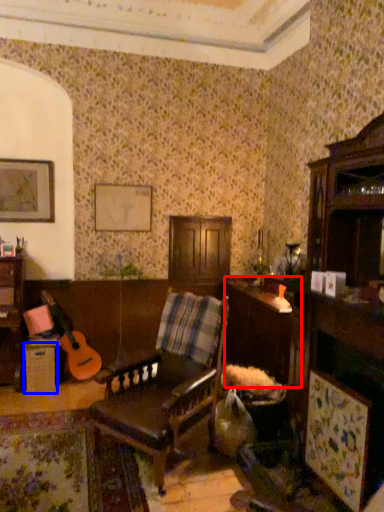
Question: Which of the following is the closest to the observer, table (highlighted by a red box) or table (highlighted by a blue box)?

Choices:
 (A) table
 (B) table

Answer: (A)